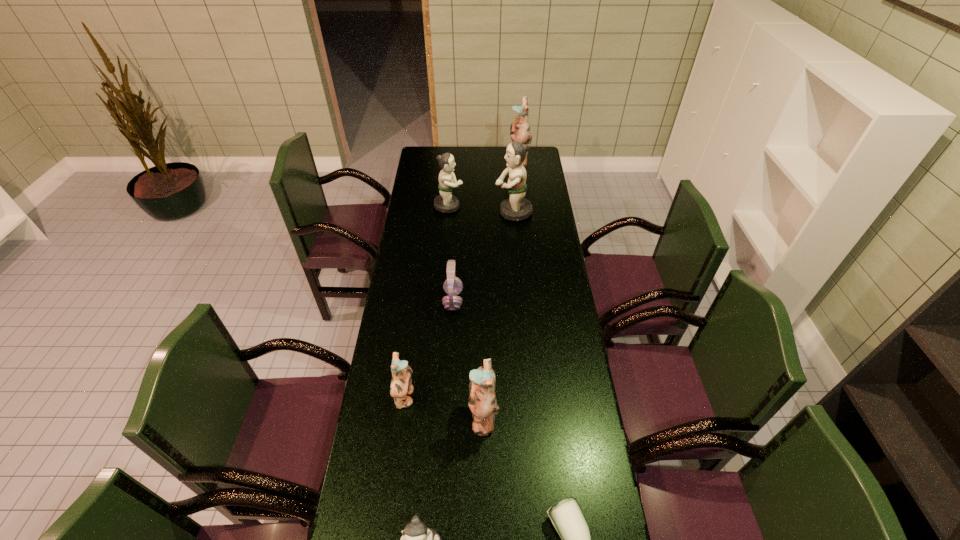
The height and width of the screenshot is (540, 960). Identify the location of the biggest green figurine. (515, 208).

At what (x,y) coordinates should I click in order to perform the action: click on the biggest pink figurine. Please return your answer as a coordinate pair (x, y). The width and height of the screenshot is (960, 540). Looking at the image, I should click on (519, 130).

At what (x,y) coordinates should I click in order to perform the action: click on the farthest pink figurine. Please return your answer as a coordinate pair (x, y). The image size is (960, 540). Looking at the image, I should click on (519, 130).

Image resolution: width=960 pixels, height=540 pixels. I want to click on the second biggest green figurine, so click(x=445, y=202).

The width and height of the screenshot is (960, 540). What are the coordinates of `the second pink figurine from right to left` in the screenshot? It's located at (482, 400).

Locate an element on the screen. the fourth object from right to left is located at coordinates (482, 400).

This screenshot has width=960, height=540. In order to click on the leftmost pink figurine in this screenshot , I will do `click(401, 384)`.

You are a GUI agent. You are given a task and a screenshot of the screen. Output one action in this format:
    pyautogui.click(x=<x>, y=<y>)
    Task: Click on the headset
    This screenshot has height=540, width=960.
    Given the screenshot: What is the action you would take?
    pyautogui.click(x=453, y=286)

The width and height of the screenshot is (960, 540). I want to click on vacant space located 0.090m on the front-facing side of the rightmost green figurine, so click(x=476, y=212).

Locate an element on the screen. vacant space located on the front-facing side of the rightmost green figurine is located at coordinates (420, 212).